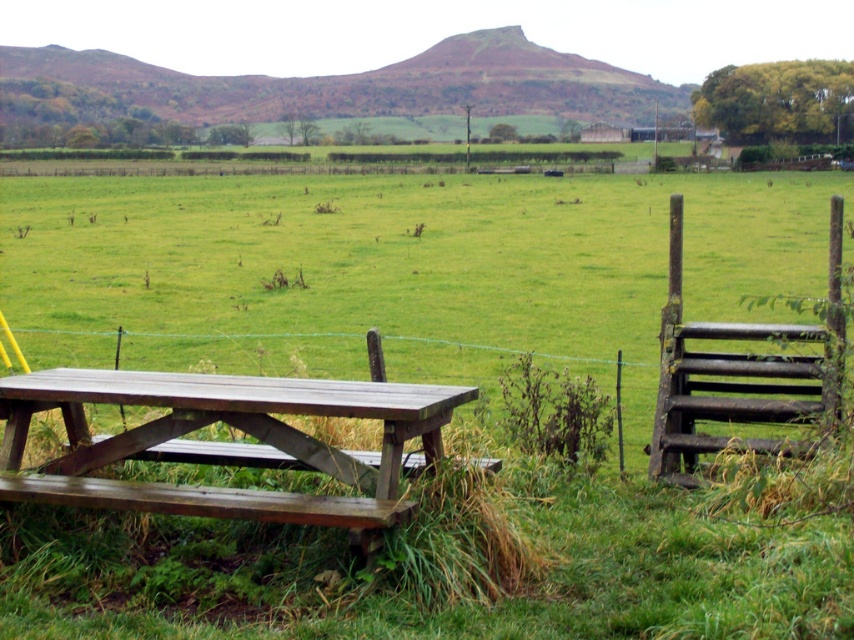
You are planning to set up a small garden between the green wood field at center and the wooden picnic table at lower left. The garden requires a minimum distance of 50 feet between the field and the table to ensure proper growth. Based on the scene, is this distance requirement met?

The green wood field at center is 56.20 feet from the wooden picnic table at lower left. Since this distance exceeds the required 50 feet, the garden setup meets the distance requirement.

You are standing at the center of the image and want to walk towards the wooden picnic table at lower left. Which direction should you move first?

Since the wooden picnic table at lower left is located at point 0.692 on the x axis and 0.267 on the y axis, you should move towards the left and downward to reach it.